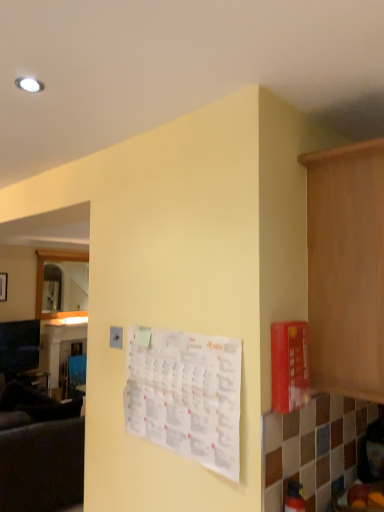
Question: From the image's perspective, is dark gray fabric couch at left on wooden cabinet at right?

Choices:
 (A) yes
 (B) no

Answer: (B)

Question: Is dark gray fabric couch at left shorter than wooden cabinet at right?

Choices:
 (A) yes
 (B) no

Answer: (B)

Question: Considering the relative sizes of dark gray fabric couch at left and wooden cabinet at right in the image provided, is dark gray fabric couch at left smaller than wooden cabinet at right?

Choices:
 (A) yes
 (B) no

Answer: (B)

Question: Is the depth of dark gray fabric couch at left greater than that of wooden cabinet at right?

Choices:
 (A) yes
 (B) no

Answer: (A)

Question: Is dark gray fabric couch at left thinner than wooden cabinet at right?

Choices:
 (A) no
 (B) yes

Answer: (A)

Question: Is dark gray fabric couch at left positioned with its back to wooden cabinet at right?

Choices:
 (A) no
 (B) yes

Answer: (A)

Question: Is dark gray fabric couch at left at the left side of white paper calendar at center?

Choices:
 (A) no
 (B) yes

Answer: (B)

Question: Could you tell me if dark gray fabric couch at left is facing white paper calendar at center?

Choices:
 (A) no
 (B) yes

Answer: (A)

Question: Is the depth of dark gray fabric couch at left greater than that of white paper calendar at center?

Choices:
 (A) no
 (B) yes

Answer: (B)

Question: Is dark gray fabric couch at left turned away from white paper calendar at center?

Choices:
 (A) no
 (B) yes

Answer: (A)

Question: Is dark gray fabric couch at left bigger than white paper calendar at center?

Choices:
 (A) yes
 (B) no

Answer: (A)

Question: From a real-world perspective, is dark gray fabric couch at left positioned over white paper calendar at center based on gravity?

Choices:
 (A) no
 (B) yes

Answer: (A)

Question: Is wooden cabinet at right facing towards white paper calendar at center?

Choices:
 (A) yes
 (B) no

Answer: (B)